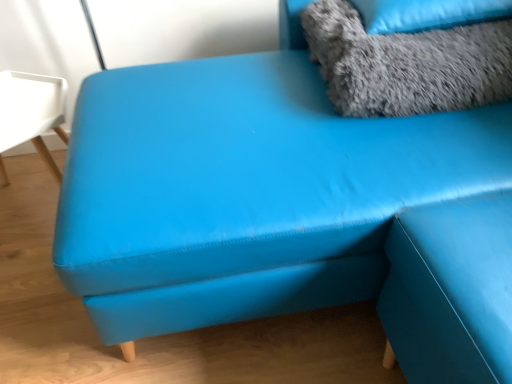
Question: From a real-world perspective, is gray fluffy pillow at upper right positioned above or below gray fluffy pillow at upper right?

Choices:
 (A) above
 (B) below

Answer: (B)

Question: In the image, is gray fluffy pillow at upper right on the left side or the right side of gray fluffy pillow at upper right?

Choices:
 (A) right
 (B) left

Answer: (B)

Question: From their relative heights in the image, would you say gray fluffy pillow at upper right is taller or shorter than gray fluffy pillow at upper right?

Choices:
 (A) tall
 (B) short

Answer: (A)

Question: From the image's perspective, is gray fluffy pillow at upper right located above or below gray fluffy pillow at upper right?

Choices:
 (A) below
 (B) above

Answer: (B)

Question: Considering the positions of gray fluffy pillow at upper right and gray fluffy pillow at upper right in the image, is gray fluffy pillow at upper right wider or thinner than gray fluffy pillow at upper right?

Choices:
 (A) thin
 (B) wide

Answer: (B)

Question: From a real-world perspective, is gray fluffy pillow at upper right physically located above or below gray fluffy pillow at upper right?

Choices:
 (A) above
 (B) below

Answer: (A)

Question: Considering their positions, is gray fluffy pillow at upper right located in front of or behind gray fluffy pillow at upper right?

Choices:
 (A) front
 (B) behind

Answer: (B)